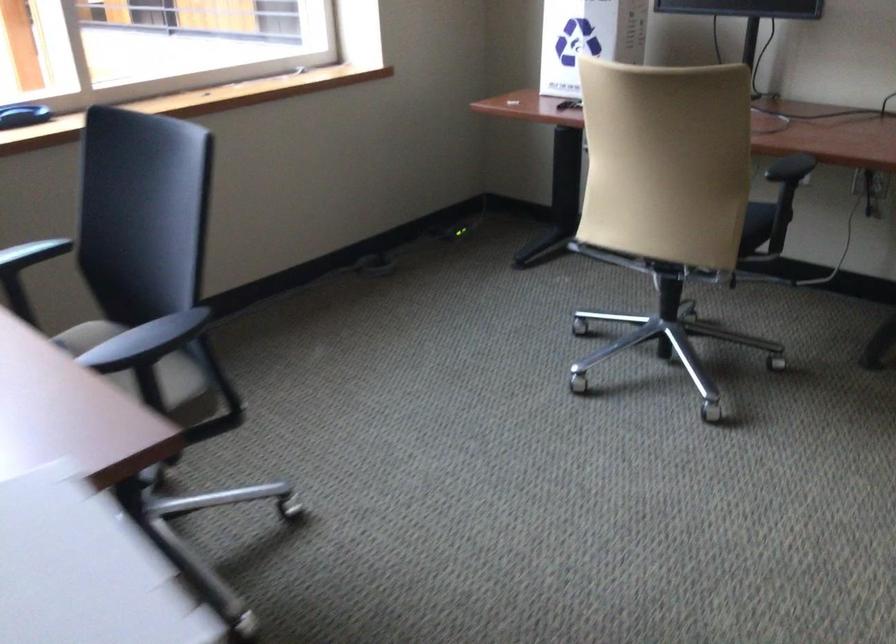
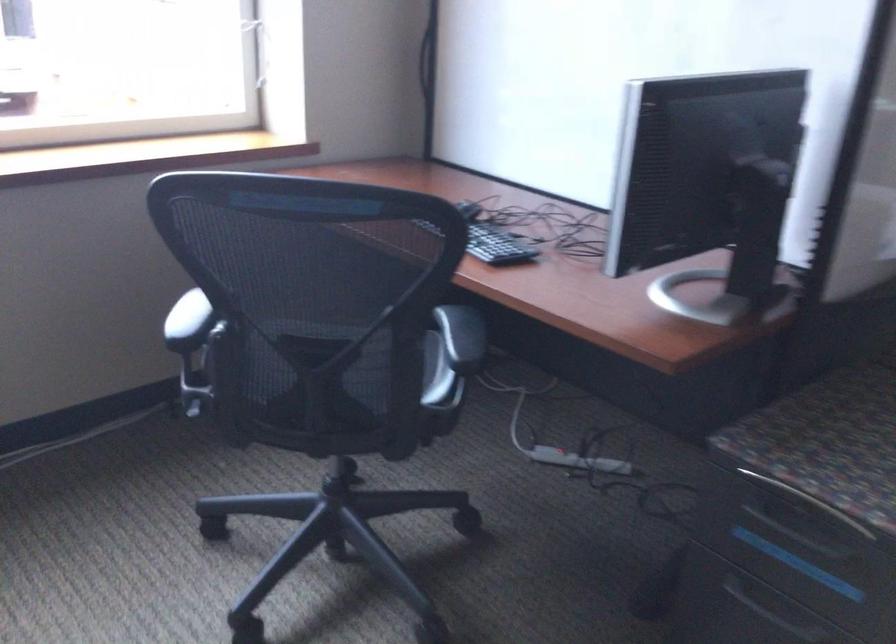
Question: I am providing you with two images of the same scene from different viewpoints. Please identify which objects are invisible in image2.

Choices:
 (A) chair sitting surface
 (B) black chair armrest
 (C) brown wicker basket
 (D) power strip switch

Answer: (B)